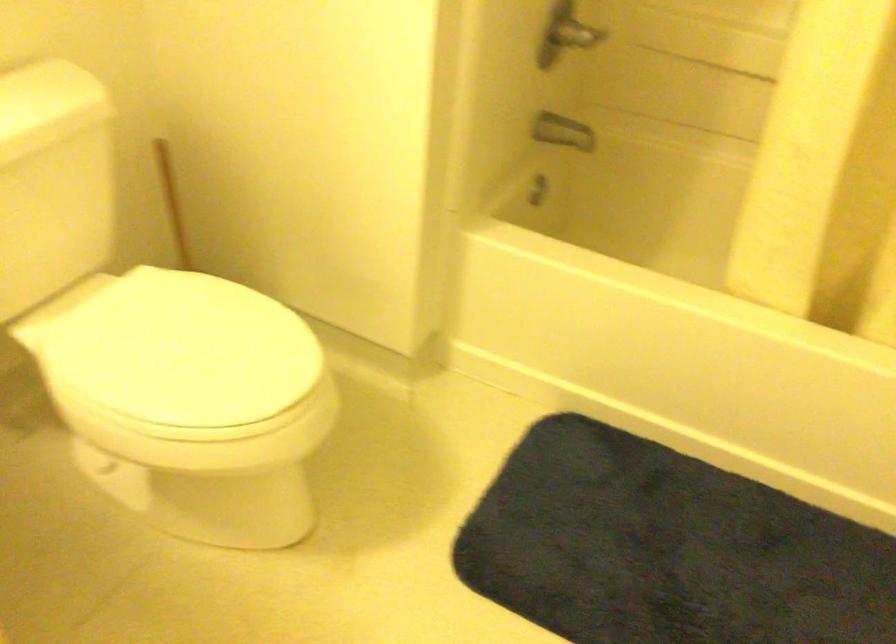
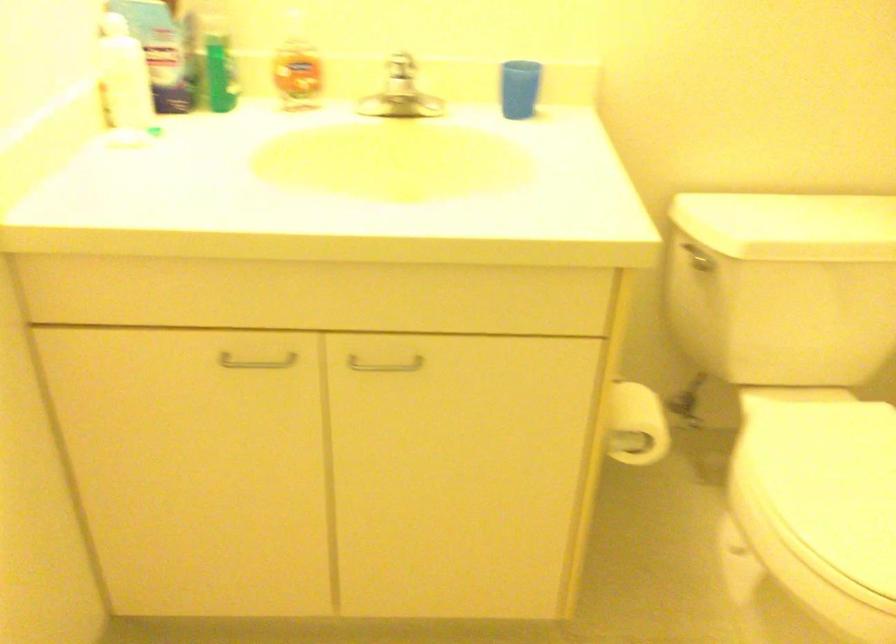
Question: How did the camera likely rotate?

Choices:
 (A) Left
 (B) Right
 (C) Up
 (D) Down

Answer: (A)